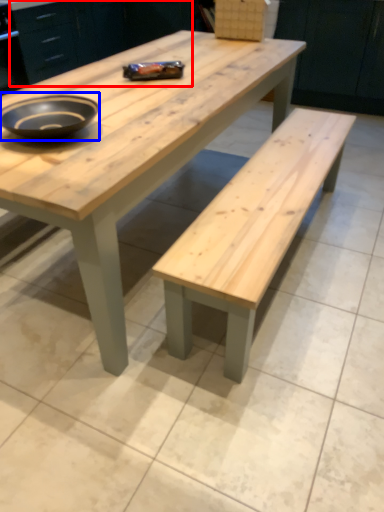
Question: Which object appears farthest to the camera in this image, cabinetry (highlighted by a red box) or bowl (highlighted by a blue box)?

Choices:
 (A) cabinetry
 (B) bowl

Answer: (A)